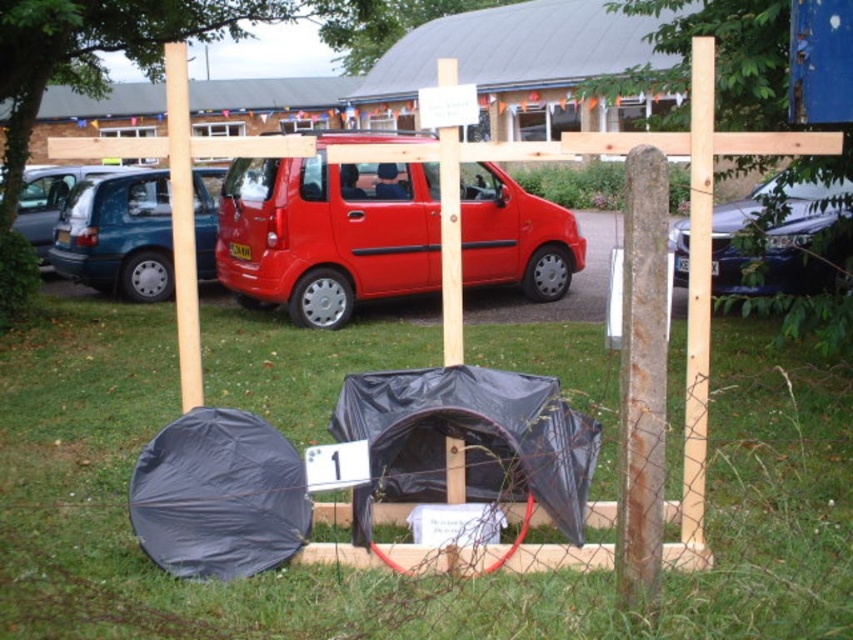
This screenshot has width=853, height=640. What do you see at coordinates (328, 228) in the screenshot?
I see `matte red van at center` at bounding box center [328, 228].

Is point (225, 227) behind point (689, 438)?

Yes, point (225, 227) is behind point (689, 438).

Describe the element at coordinates (328, 228) in the screenshot. I see `matte red van at center` at that location.

Where is `matte red van at center`? The image size is (853, 640). matte red van at center is located at coordinates (328, 228).

You are a GUI agent. You are given a task and a screenshot of the screen. Output one action in this format:
    pyautogui.click(x=<x>, y=<y>)
    Task: Click on the dark gray tarp at lower left
    This screenshot has height=640, width=853.
    Given the screenshot: What is the action you would take?
    pyautogui.click(x=219, y=497)

Between dark gray tarp at lower left and shiny black car at right, which one appears on the left side from the viewer's perspective?

dark gray tarp at lower left is more to the left.

Is point (285, 508) positioned before point (686, 262)?

Yes, point (285, 508) is in front of point (686, 262).

At what (x,y) coordinates should I click in order to perform the action: click on dark gray tarp at lower left. Please return your answer as a coordinate pair (x, y). The image size is (853, 640). Looking at the image, I should click on (219, 497).

Can you confirm if green grass at center is wider than black tarpaulin tent at center?

Yes, green grass at center is wider than black tarpaulin tent at center.

Does green grass at center appear on the right side of black tarpaulin tent at center?

No, green grass at center is not to the right of black tarpaulin tent at center.

Is point (119, 566) closer to viewer compared to point (467, 440)?

Yes, it is.

This screenshot has height=640, width=853. Find the location of `green grass at center`. green grass at center is located at coordinates (143, 554).